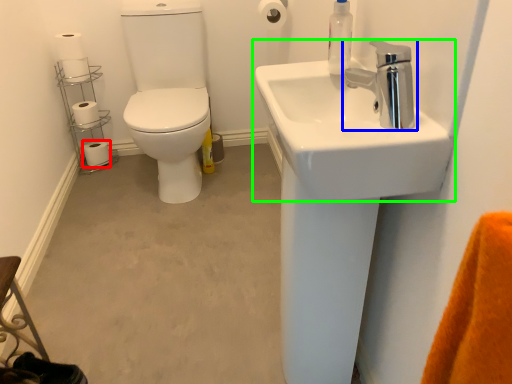
Question: Which object is the closest to the toilet paper (highlighted by a red box)? Choose among these: tap (highlighted by a blue box) or sink (highlighted by a green box).

Choices:
 (A) tap
 (B) sink

Answer: (B)